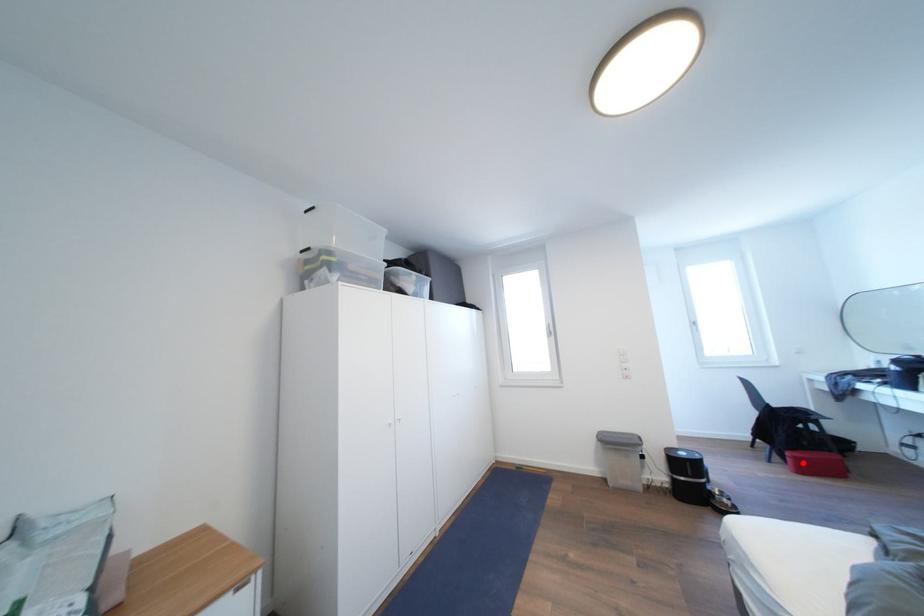
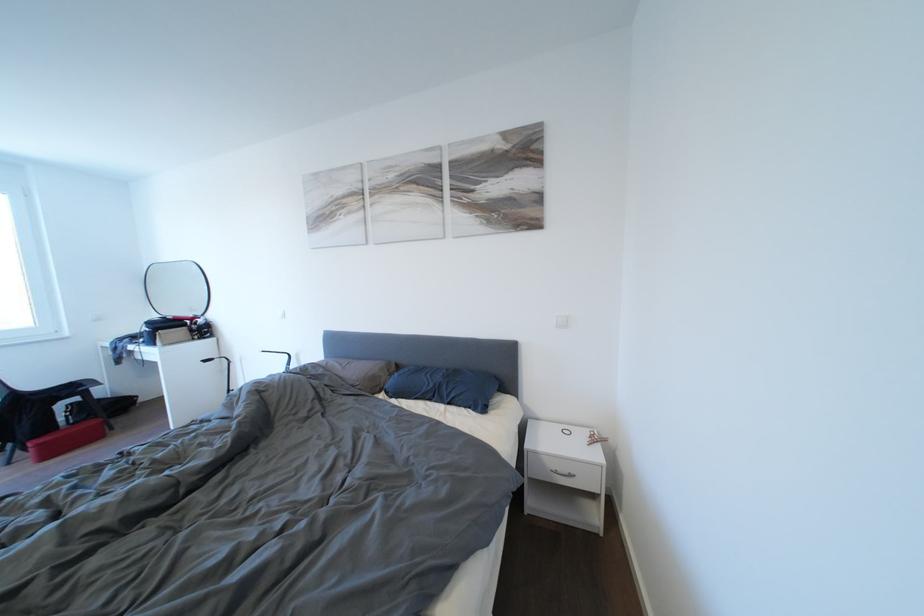
Question: I am providing you with two images of the same scene from different viewpoints. Image1 has a red point marked. In image2, the corresponding 3D location appears at what relative position? Reply with the corresponding letter.

Choices:
 (A) Closer
 (B) Farther

Answer: (A)